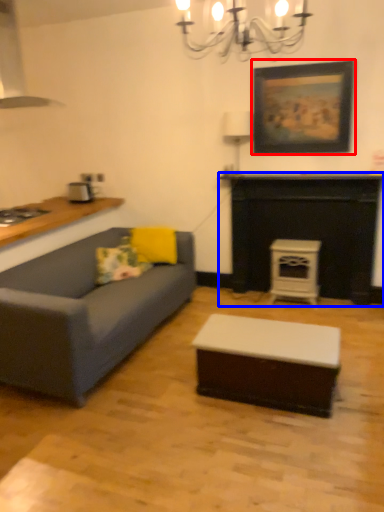
Question: Which object is closer to the camera taking this photo, picture frame (highlighted by a red box) or fireplace (highlighted by a blue box)?

Choices:
 (A) picture frame
 (B) fireplace

Answer: (A)